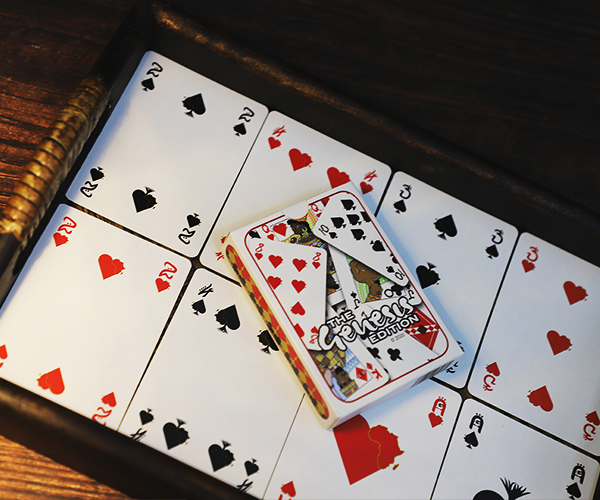
Where is `box`? The image size is (600, 500). box is located at coordinates (332, 417).